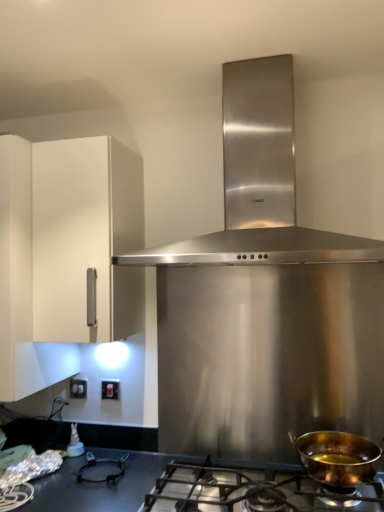
I want to click on free space above stainless steel range hood at center (from a real-world perspective), so click(251, 51).